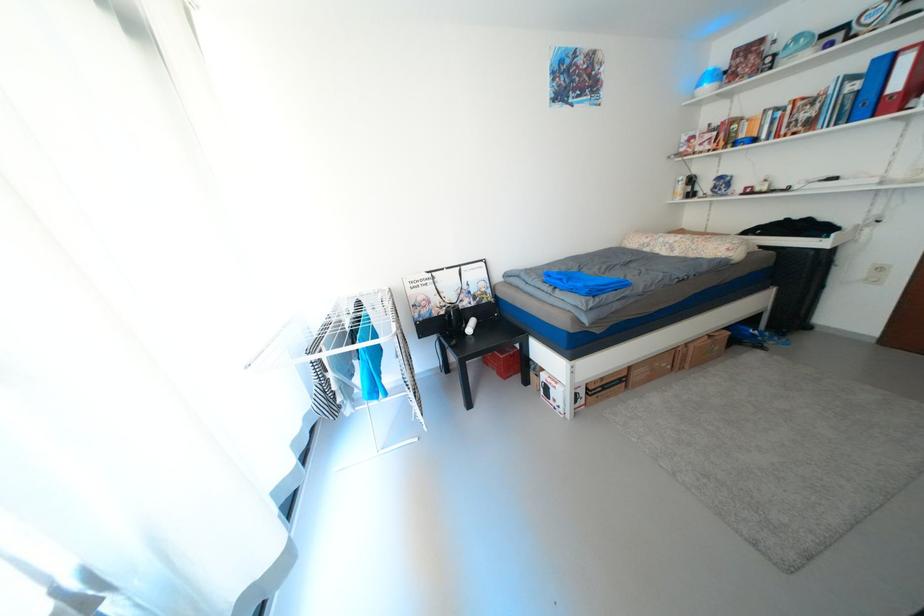
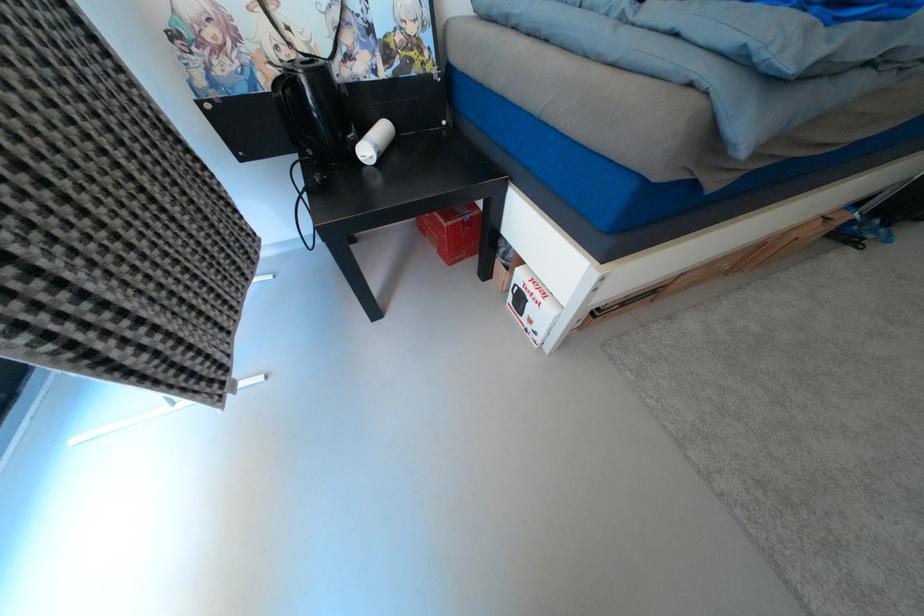
Question: The first image is from the beginning of the video and the second image is from the end. How did the camera likely rotate when shooting the video?

Choices:
 (A) Left
 (B) Right
 (C) Up
 (D) Down

Answer: (D)